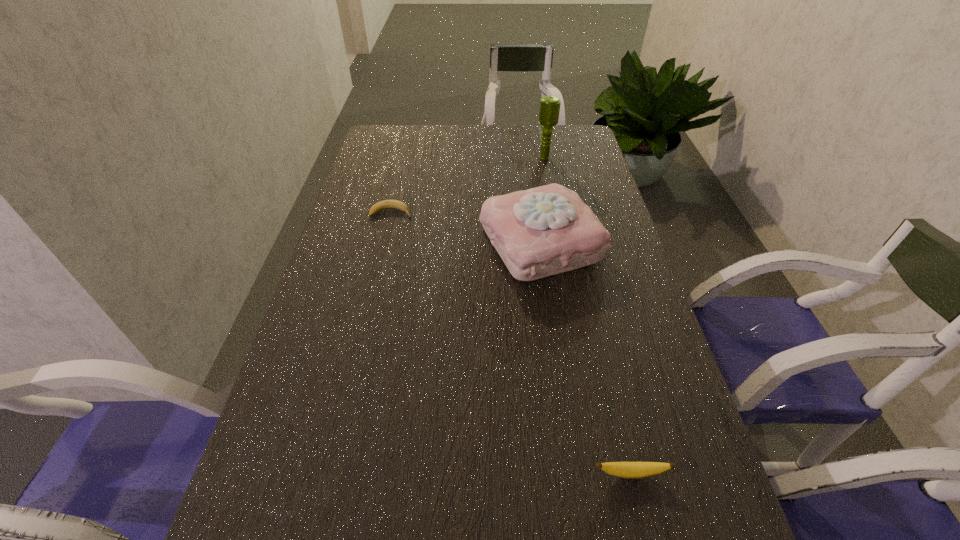
What are the coordinates of `the tallest object` in the screenshot? It's located at (549, 110).

This screenshot has height=540, width=960. Identify the location of microphone. (549, 110).

What are the coordinates of `the third shortest object` in the screenshot? It's located at (543, 231).

Image resolution: width=960 pixels, height=540 pixels. In order to click on the right banana in this screenshot , I will do coord(633,470).

The image size is (960, 540). I want to click on the nearer banana, so click(x=633, y=470).

Where is `the left banana`? The width and height of the screenshot is (960, 540). the left banana is located at coordinates (386, 204).

Locate an element on the screen. Image resolution: width=960 pixels, height=540 pixels. the farther banana is located at coordinates (386, 204).

At what (x,y) coordinates should I click in order to perform the action: click on vacant space situated on the front of the farthest object. Please return your answer as a coordinate pair (x, y). Looking at the image, I should click on (547, 175).

Locate an element on the screen. This screenshot has width=960, height=540. free space located 0.060m on the right of the cake is located at coordinates pyautogui.click(x=624, y=242).

Find the location of a particular element. free space located 0.320m on the back of the right banana is located at coordinates coord(596,327).